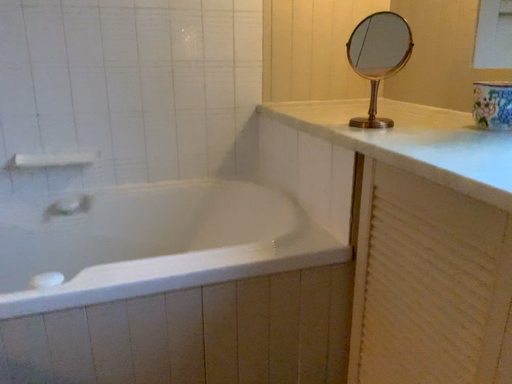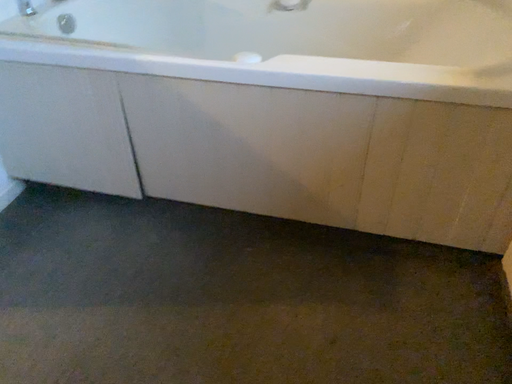
Question: How did the camera likely rotate when shooting the video?

Choices:
 (A) rotated upward
 (B) rotated downward

Answer: (B)